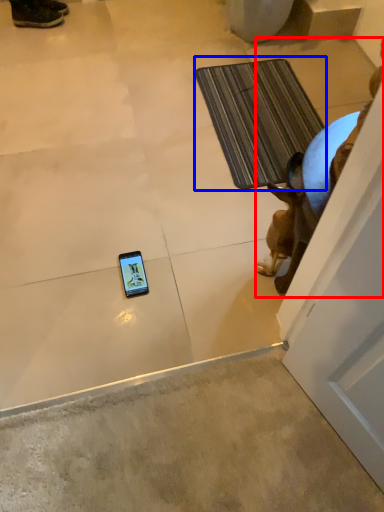
Question: Which of the following is the farthest to the observer, animal (highlighted by a red box) or bath mat (highlighted by a blue box)?

Choices:
 (A) animal
 (B) bath mat

Answer: (B)